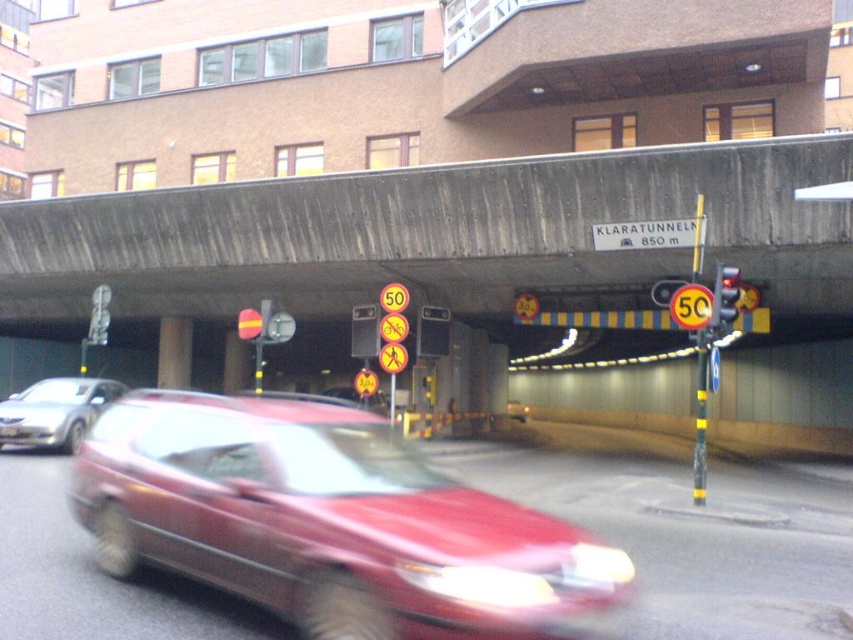
You are driving a car that is 4.5 meters long. You see the concrete overpass at center and the yellow reflective pedestrian crossing sign at center ahead on the road. Can your car fit between them without touching either?

The concrete overpass at center and yellow reflective pedestrian crossing sign at center are 5.13 meters apart from each other. Since your car is 4.5 meters long, it can fit between them without touching either.

You are a cyclist approaching the yellow reflective bicycle at center and need to pass the silver metallic sedan at left parked on the side of the road. Can you safely ride your bike around it without going into the road lane?

The silver metallic sedan at left is bigger than the yellow reflective bicycle at center, so it may block your path. However, since the sedan is parked on the side, there might be enough space to pass safely if you stay within the designated bike lane. Check for clearance before proceeding.